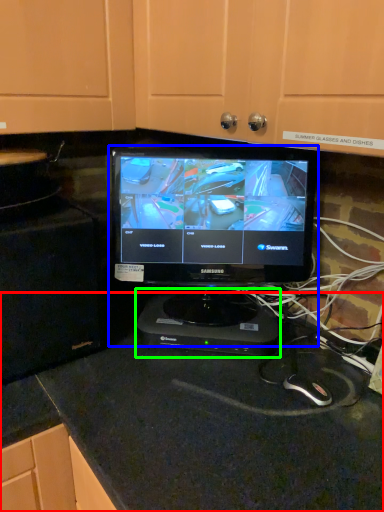
Question: Considering the real-world distances, which object is farthest from counter top (highlighted by a red box)? computer monitor (highlighted by a blue box) or appliance (highlighted by a green box)?

Choices:
 (A) computer monitor
 (B) appliance

Answer: (A)